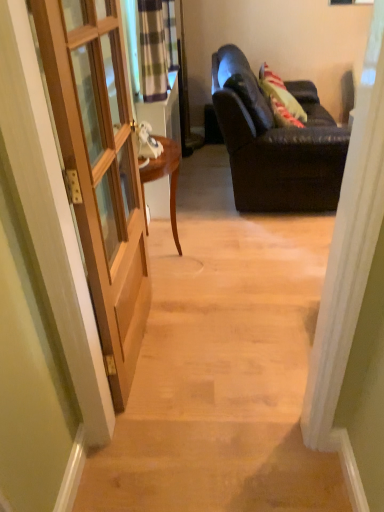
Question: Can you confirm if wooden door at left is smaller than wooden door at left?

Choices:
 (A) no
 (B) yes

Answer: (B)

Question: Considering the relative sizes of wooden door at left and wooden door at left in the image provided, is wooden door at left shorter than wooden door at left?

Choices:
 (A) no
 (B) yes

Answer: (A)

Question: Is wooden door at left looking in the opposite direction of wooden door at left?

Choices:
 (A) no
 (B) yes

Answer: (A)

Question: Can you confirm if wooden door at left is bigger than wooden door at left?

Choices:
 (A) yes
 (B) no

Answer: (B)

Question: Is wooden door at left not near wooden door at left?

Choices:
 (A) yes
 (B) no

Answer: (B)

Question: Does wooden door at left turn towards wooden door at left?

Choices:
 (A) yes
 (B) no

Answer: (B)

Question: From the image's perspective, is wooden door at left located beneath wooden door at left?

Choices:
 (A) no
 (B) yes

Answer: (B)

Question: Is wooden door at left outside of wooden door at left?

Choices:
 (A) yes
 (B) no

Answer: (A)

Question: Can you confirm if wooden door at left is shorter than wooden door at left?

Choices:
 (A) no
 (B) yes

Answer: (B)

Question: Is wooden door at left directly adjacent to wooden door at left?

Choices:
 (A) no
 (B) yes

Answer: (A)

Question: Does wooden door at left have a greater height compared to wooden door at left?

Choices:
 (A) yes
 (B) no

Answer: (B)

Question: Is wooden door at left completely or partially inside wooden door at left?

Choices:
 (A) yes
 (B) no

Answer: (B)

Question: Can you confirm if wooden door at left is smaller than dark brown leather couch at right?

Choices:
 (A) yes
 (B) no

Answer: (A)